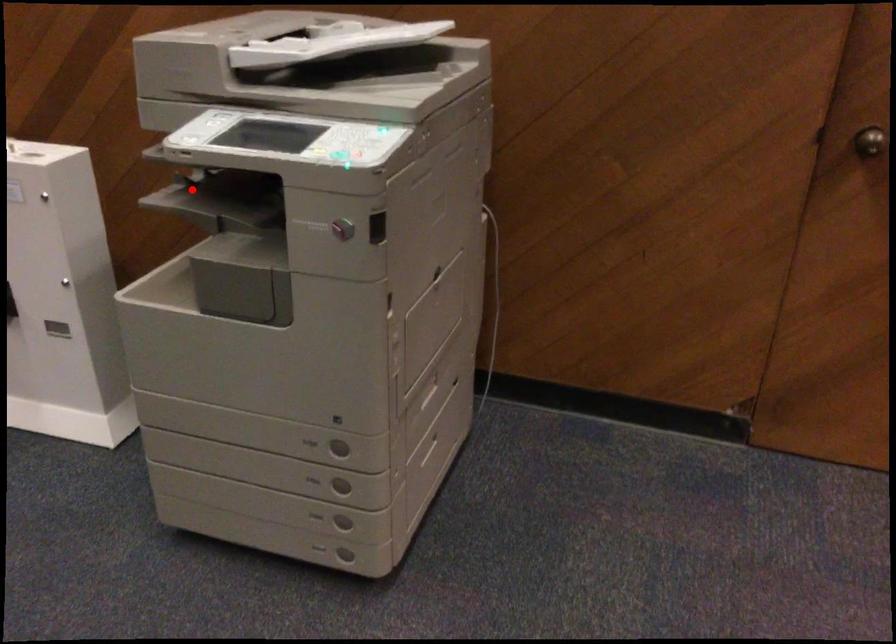
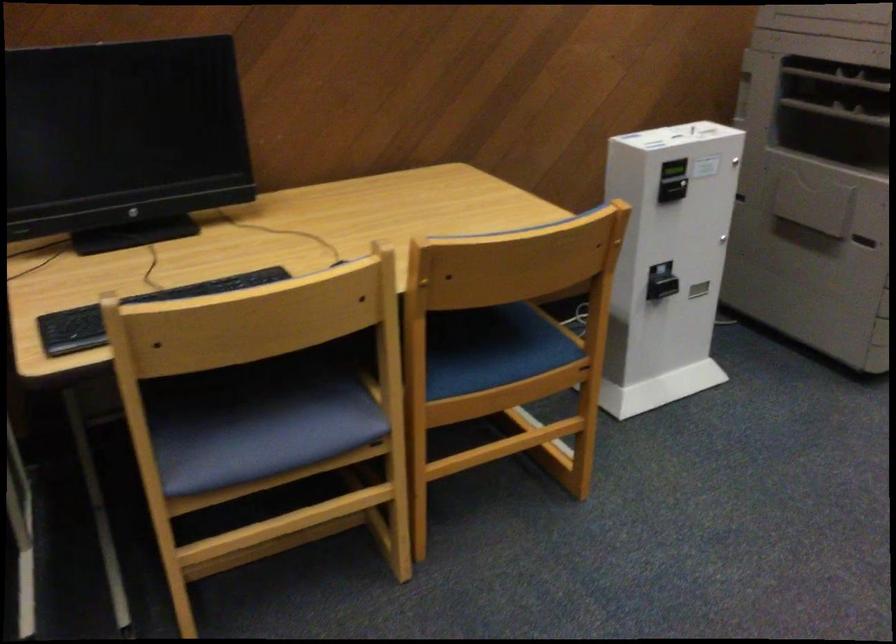
Question: I am providing you with two images of the same scene from different viewpoints. In image1, a red point is highlighted. Considering the same 3D point in image2, which of the following is correct?

Choices:
 (A) It is closer
 (B) It is farther

Answer: (B)